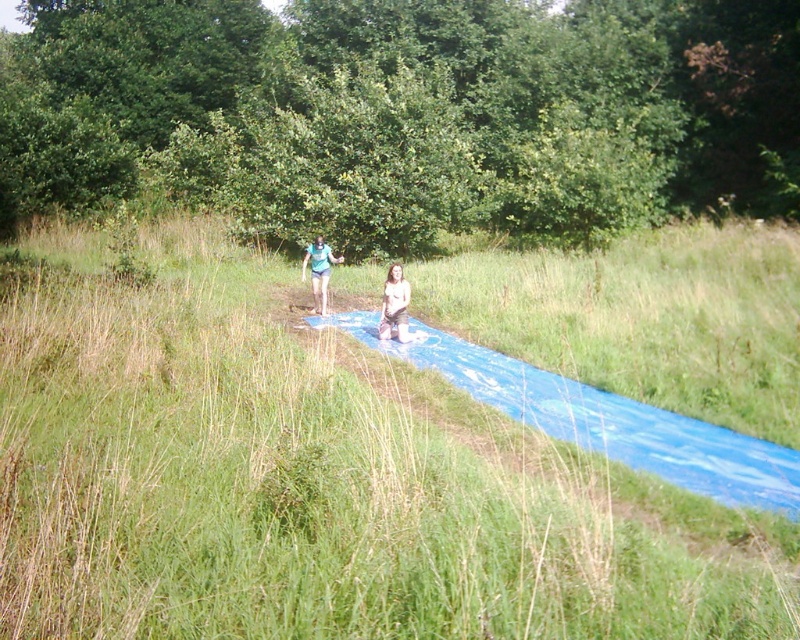
Question: Can you confirm if blue rubber mat at center is smaller than tan skin person at center?

Choices:
 (A) no
 (B) yes

Answer: (A)

Question: Which point is farther to the camera?

Choices:
 (A) (404, 323)
 (B) (341, 257)

Answer: (B)

Question: Estimate the real-world distances between objects in this image. Which object is farther from the blue rubber mat at center?

Choices:
 (A) tan skin person at center
 (B) matte blue shorts at center

Answer: (B)

Question: Does blue rubber mat at center have a larger size compared to tan skin person at center?

Choices:
 (A) no
 (B) yes

Answer: (B)

Question: Does tan skin person at center appear over matte blue shorts at center?

Choices:
 (A) no
 (B) yes

Answer: (A)

Question: Which point is closer to the camera?

Choices:
 (A) (702, 500)
 (B) (400, 305)
 (C) (322, 268)

Answer: (A)